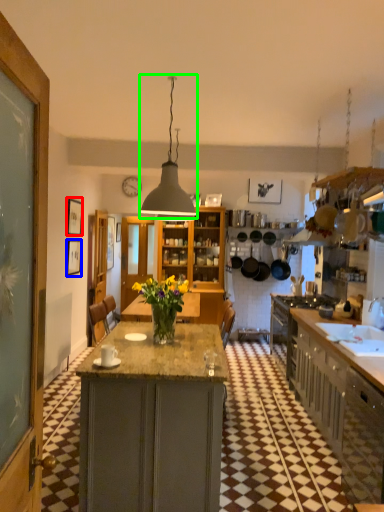
Question: Based on their relative distances, which object is farther from picture frame (highlighted by a red box)? Choose from picture frame (highlighted by a blue box) and light fixture (highlighted by a green box).

Choices:
 (A) picture frame
 (B) light fixture

Answer: (B)